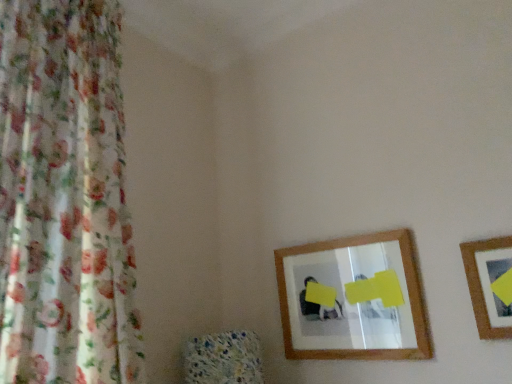
Question: Should I look upward or downward to see wooden picture frame at right?

Choices:
 (A) up
 (B) down

Answer: (B)

Question: Is wooden-framed mirror at center thinner than wooden picture frame at right?

Choices:
 (A) no
 (B) yes

Answer: (A)

Question: Is wooden-framed mirror at center at the left side of wooden picture frame at right?

Choices:
 (A) yes
 (B) no

Answer: (A)

Question: Is wooden-framed mirror at center far from wooden picture frame at right?

Choices:
 (A) yes
 (B) no

Answer: (B)

Question: Is wooden-framed mirror at center to the right of wooden picture frame at right from the viewer's perspective?

Choices:
 (A) yes
 (B) no

Answer: (B)

Question: From the image's perspective, would you say wooden-framed mirror at center is positioned over wooden picture frame at right?

Choices:
 (A) no
 (B) yes

Answer: (A)

Question: Would you say wooden picture frame at right is part of wooden-framed mirror at center's contents?

Choices:
 (A) yes
 (B) no

Answer: (B)

Question: From the image's perspective, would you say wooden picture frame at right is positioned over wooden-framed mirror at center?

Choices:
 (A) no
 (B) yes

Answer: (B)

Question: Does wooden picture frame at right touch wooden-framed mirror at center?

Choices:
 (A) no
 (B) yes

Answer: (A)

Question: Considering the relative sizes of wooden picture frame at right and wooden-framed mirror at center in the image provided, is wooden picture frame at right wider than wooden-framed mirror at center?

Choices:
 (A) no
 (B) yes

Answer: (A)

Question: Is wooden picture frame at right further to the viewer compared to wooden-framed mirror at center?

Choices:
 (A) no
 (B) yes

Answer: (A)

Question: Is wooden picture frame at right at the left side of wooden-framed mirror at center?

Choices:
 (A) yes
 (B) no

Answer: (B)

Question: Can you confirm if wooden picture frame at right is bigger than wooden-framed mirror at center?

Choices:
 (A) no
 (B) yes

Answer: (A)

Question: Is wooden picture frame at right inside floral fabric curtain at left?

Choices:
 (A) yes
 (B) no

Answer: (B)